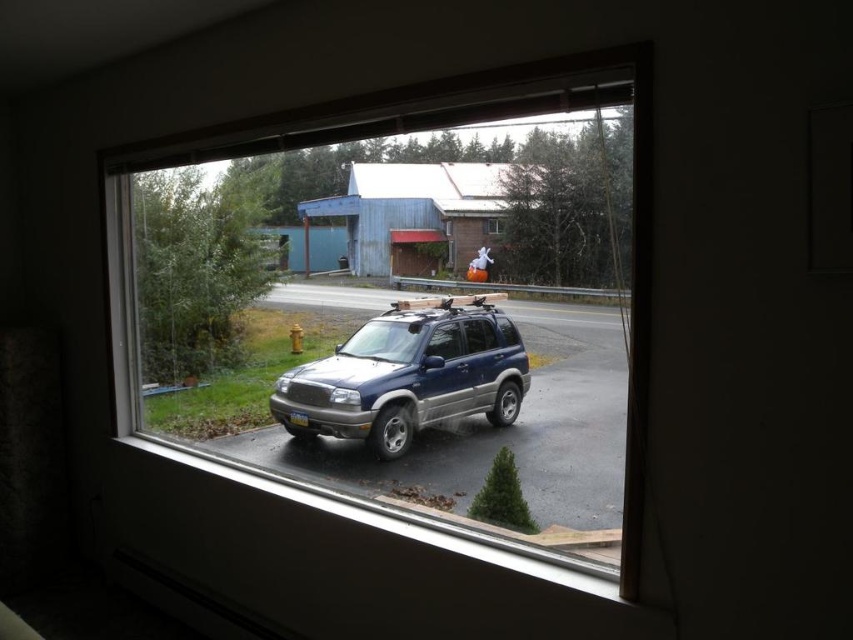
Based on the photo, is satin blue suv at center bigger than transparent glass window at center?

Yes.

Between satin blue suv at center and transparent glass window at center, which one has less height?

Standing shorter between the two is transparent glass window at center.

Which is behind, point (374, 403) or point (503, 230)?

The point (374, 403) is more distant.

The width and height of the screenshot is (853, 640). Find the location of `satin blue suv at center`. satin blue suv at center is located at coordinates (408, 376).

Is clear glass window at center taller than satin blue suv at center?

Yes, clear glass window at center is taller than satin blue suv at center.

Describe the element at coordinates (412, 300) in the screenshot. I see `clear glass window at center` at that location.

Between point (306, 163) and point (375, 324), which one is positioned behind?

The point (306, 163) is more distant.

Find the location of a particular element. clear glass window at center is located at coordinates (412, 300).

Describe the element at coordinates (412, 300) in the screenshot. I see `clear glass window at center` at that location.

Which of these two, clear glass window at center or transparent glass window at center, stands taller?

clear glass window at center

Which is behind, point (200, 227) or point (492, 218)?

Point (200, 227)

What are the coordinates of `clear glass window at center` in the screenshot? It's located at (412, 300).